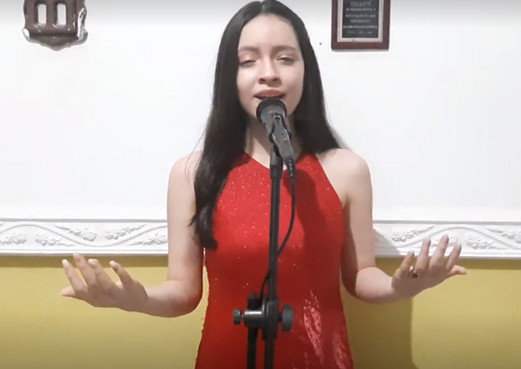
You are a GUI agent. You are given a task and a screenshot of the screen. Output one action in this format:
    pyautogui.click(x=<x>, y=<y>)
    Task: Click on the bottom part of wall
    Image resolution: width=521 pixels, height=369 pixels.
    Given the screenshot: What is the action you would take?
    pyautogui.click(x=461, y=329)